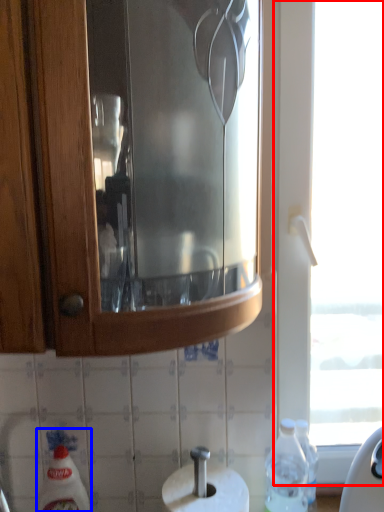
Question: Which point is closer to the camera, window (highlighted by a red box) or cleaning product (highlighted by a blue box)?

Choices:
 (A) window
 (B) cleaning product

Answer: (B)